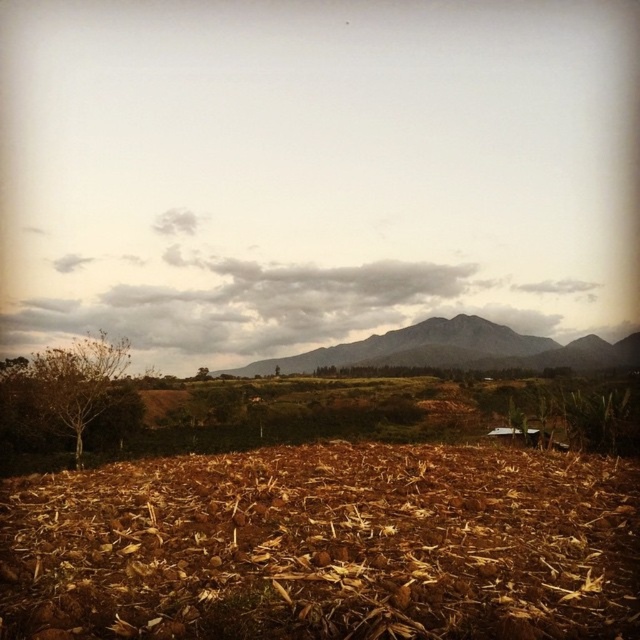
In the scene shown: You are standing in the middle of the field and see the brown leafy tree at left and the green leafy tree at center. Which tree is higher in the scene?

The brown leafy tree at left is above the green leafy tree at center, so it is higher in the scene.

You are an environmental scientist assessing the landscape. You need to determine which object is nearer to you between the gray rocky mountain at center and the green leafy tree at center. Based on the scene, which one is closer?

The gray rocky mountain at center is closer to the viewer than the green leafy tree at center.

You are standing in the middle of the freshly plowed field and want to walk towards the brown leafy tree at left. Which direction should you head to reach it?

The brown leafy tree at left is located at point coordinates, so you should head towards the left direction to reach it.